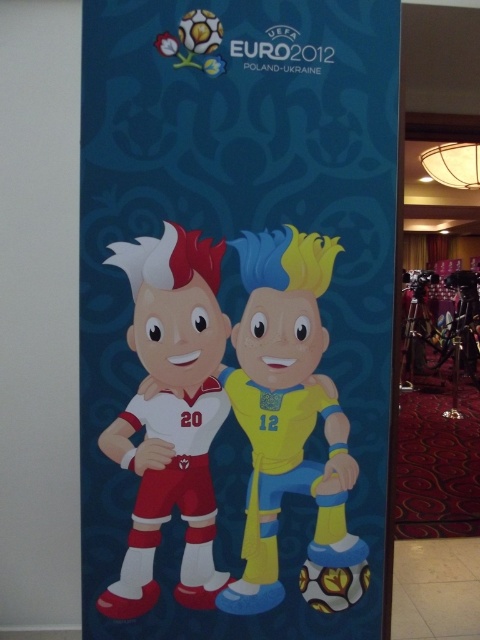
Between glossy paper poster at center and yellow matte soccer ball at center, which one appears on the right side from the viewer's perspective?

yellow matte soccer ball at center is more to the right.

Is glossy paper poster at center positioned at the back of yellow matte soccer ball at center?

No, glossy paper poster at center is closer to the viewer.

Between point (331, 19) and point (311, 240), which one is positioned in front?

Point (331, 19)

This screenshot has height=640, width=480. I want to click on glossy paper poster at center, so click(236, 314).

Consider the image. Who is higher up, yellow matte soccer ball at center or matte white jersey at center?

matte white jersey at center

Can you confirm if yellow matte soccer ball at center is positioned below matte white jersey at center?

Indeed, yellow matte soccer ball at center is positioned under matte white jersey at center.

Between point (276, 246) and point (129, 532), which one is positioned in front?

Point (276, 246) is in front.

The height and width of the screenshot is (640, 480). I want to click on yellow matte soccer ball at center, so click(287, 410).

This screenshot has width=480, height=640. Describe the element at coordinates (236, 314) in the screenshot. I see `glossy paper poster at center` at that location.

Is glossy paper poster at center shorter than matte white jersey at center?

In fact, glossy paper poster at center may be taller than matte white jersey at center.

Describe the element at coordinates (236, 314) in the screenshot. I see `glossy paper poster at center` at that location.

At what (x,y) coordinates should I click in order to perform the action: click on glossy paper poster at center. Please return your answer as a coordinate pair (x, y). Looking at the image, I should click on point(236,314).